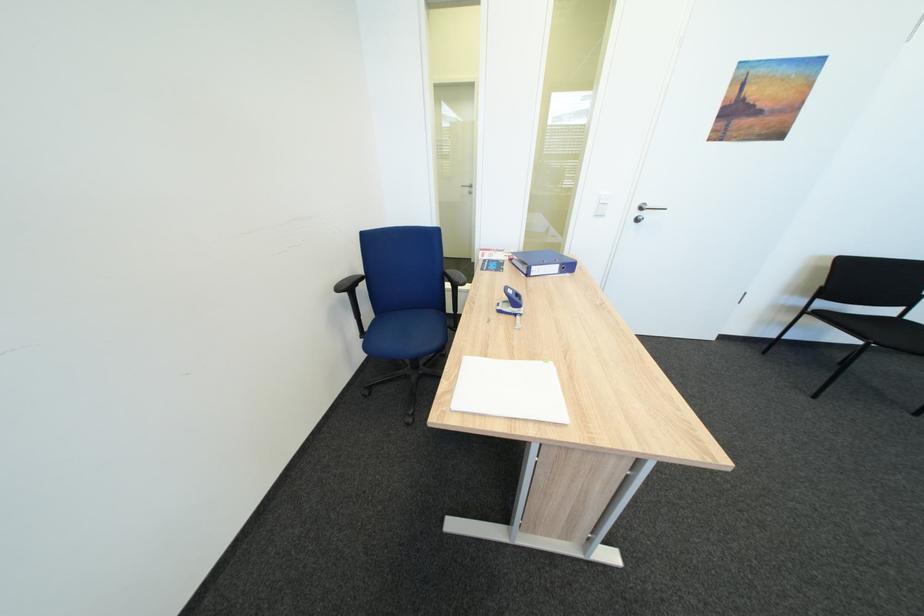
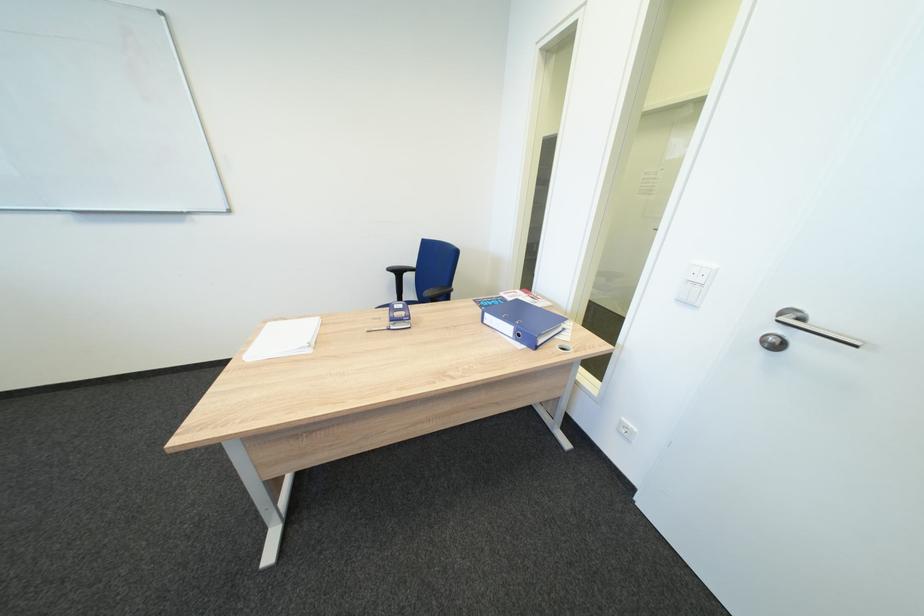
Find the pixel in the second image that matches [605,217] in the first image.

(687, 302)